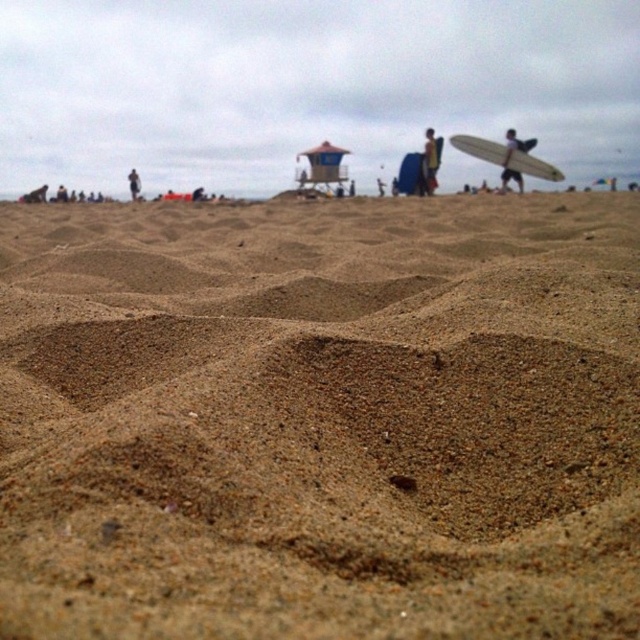
Question: Based on their relative distances, which object is nearer to the matte black surfboard at right?

Choices:
 (A) smooth white surfboard at right
 (B) dark gray fabric at upper left
 (C) white matte surfboard at upper right
 (D) fine-grained sand at center

Answer: (C)

Question: Can you confirm if white matte surfboard at upper right is positioned above smooth white surfboard at right?

Choices:
 (A) yes
 (B) no

Answer: (B)

Question: Which of the following is the farthest from the observer?

Choices:
 (A) (131, 179)
 (B) (296, 502)

Answer: (A)

Question: Considering the relative positions of fine-grained sand at center and smooth white surfboard at right in the image provided, where is fine-grained sand at center located with respect to smooth white surfboard at right?

Choices:
 (A) left
 (B) right

Answer: (A)

Question: Does white matte surfboard at upper right appear on the left side of matte black surfboard at right?

Choices:
 (A) yes
 (B) no

Answer: (B)

Question: Which point appears farthest from the camera in this image?

Choices:
 (A) (580, 440)
 (B) (532, 145)

Answer: (B)